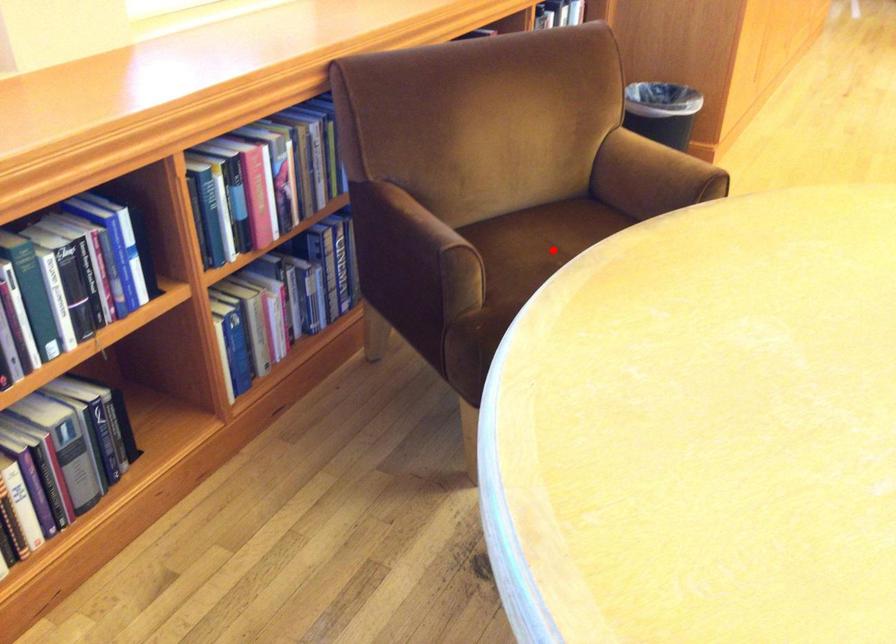
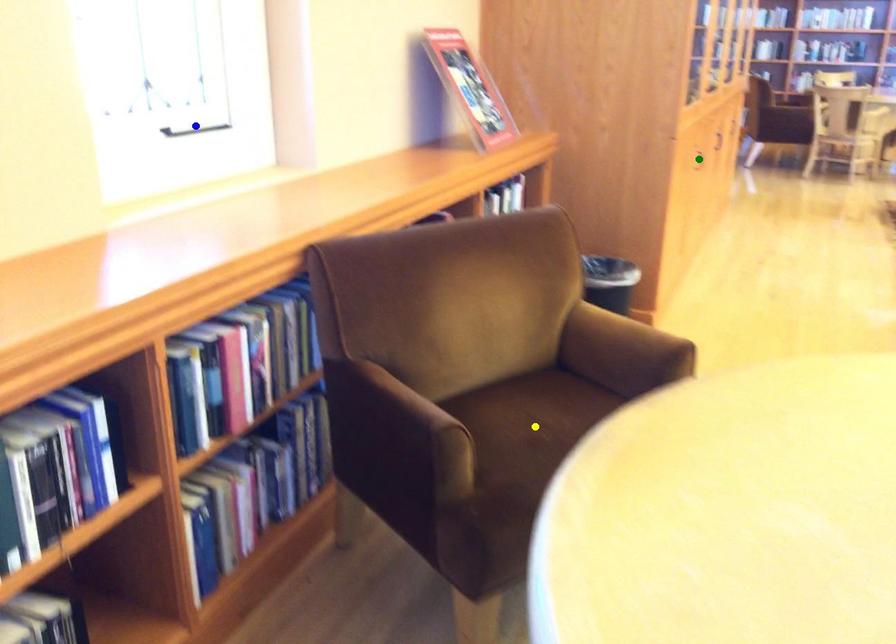
Question: I am providing you with two images of the same scene from different viewpoints. A red point is marked on the first image. You are given multiple points on the second image. Which mark in image 2 goes with the point in image 1?

Choices:
 (A) yellow point
 (B) green point
 (C) blue point

Answer: (A)